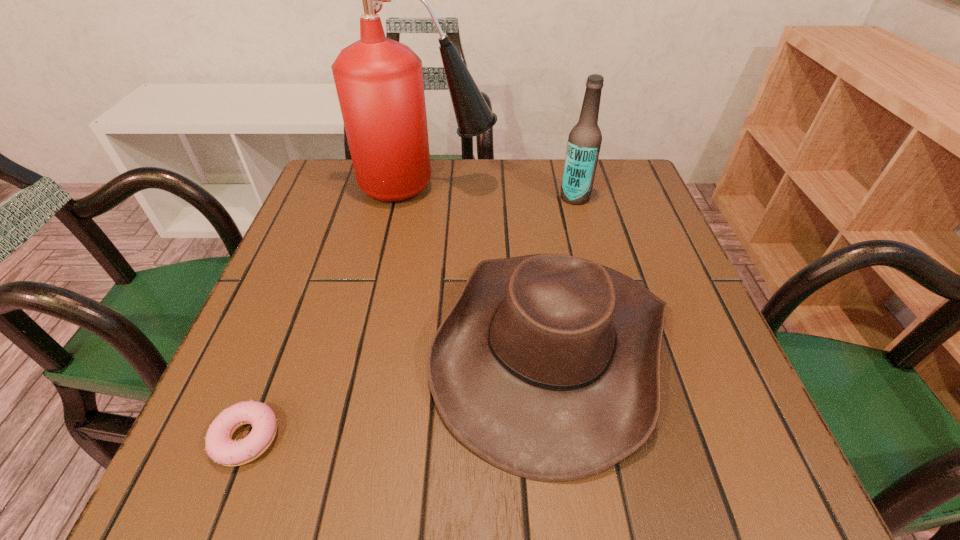
Image resolution: width=960 pixels, height=540 pixels. What are the coordinates of `object that is at the far right corner` in the screenshot? It's located at (584, 142).

Locate an element on the screen. The width and height of the screenshot is (960, 540). object that is at the near right corner is located at coordinates (547, 366).

The width and height of the screenshot is (960, 540). Find the location of `vacant space at the far edge`. vacant space at the far edge is located at coordinates (531, 210).

Where is `blank space at the near edge`? The height and width of the screenshot is (540, 960). blank space at the near edge is located at coordinates (425, 444).

At what (x,y) coordinates should I click in order to perform the action: click on vacant space at the left edge of the desktop. Please return your answer as a coordinate pair (x, y). The height and width of the screenshot is (540, 960). Looking at the image, I should click on (324, 269).

In the image, there is a desktop. Identify the location of blank space at the right edge. This screenshot has height=540, width=960. (660, 262).

Locate an element on the screen. This screenshot has width=960, height=540. vacant space at the far left corner of the desktop is located at coordinates (358, 210).

You are a GUI agent. You are given a task and a screenshot of the screen. Output one action in this format:
    pyautogui.click(x=<x>, y=<y>)
    Task: Click on the vacant space at the far right corner
    The height and width of the screenshot is (540, 960).
    Given the screenshot: What is the action you would take?
    pyautogui.click(x=629, y=178)

I want to click on free space between the shortest object and the fire extinguisher, so click(336, 313).

Where is `free spot between the shortest object and the fire extinguisher`? free spot between the shortest object and the fire extinguisher is located at coordinates (336, 313).